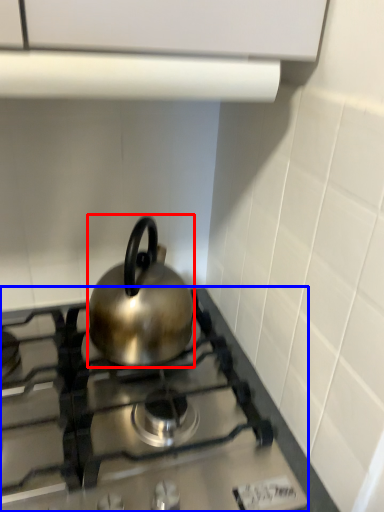
Question: Which point is closer to the camera, kettle (highlighted by a red box) or gas stove (highlighted by a blue box)?

Choices:
 (A) kettle
 (B) gas stove

Answer: (B)